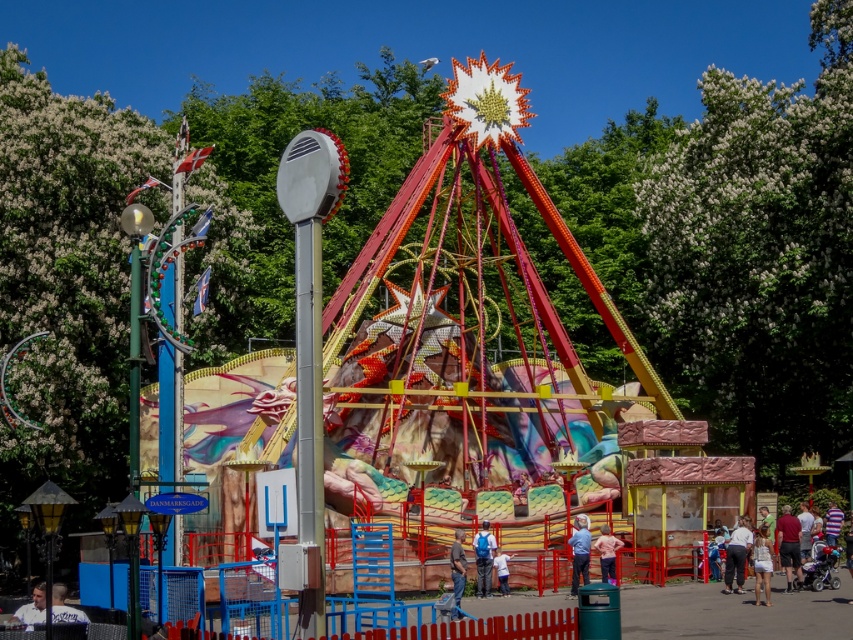
You are standing at the entrance of the amusement park and see the light pink fabric dress at center. If you walk straight ahead, will the dress come into your line of sight?

The light pink fabric dress at center is positioned at point (607, 552), which is likely within your line of sight as you walk straight ahead from the entrance, so yes, it will come into your line of sight.

From the picture: You are standing in the amusement park and see both the light brown leather jacket at lower left and the white cotton dress at center. Which one is nearer to you?

The light brown leather jacket at lower left is closer to the viewer than the white cotton dress at center.